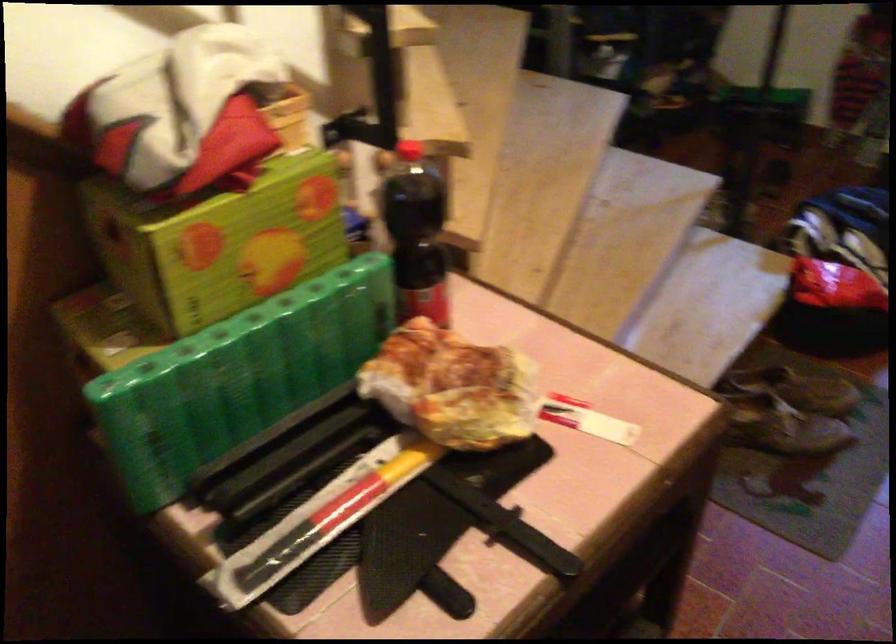
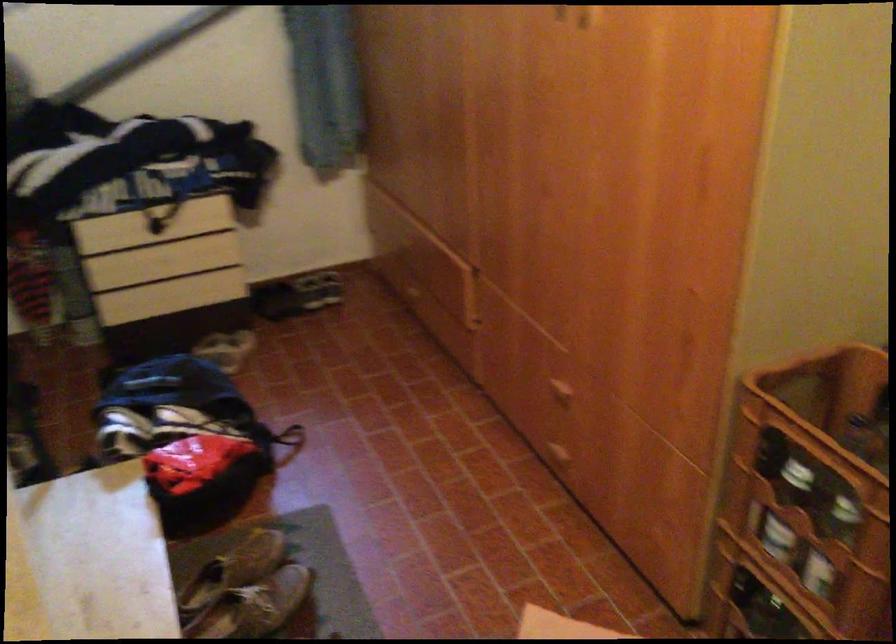
Question: How did the camera likely rotate?

Choices:
 (A) Left
 (B) Right
 (C) Up
 (D) Down

Answer: (B)